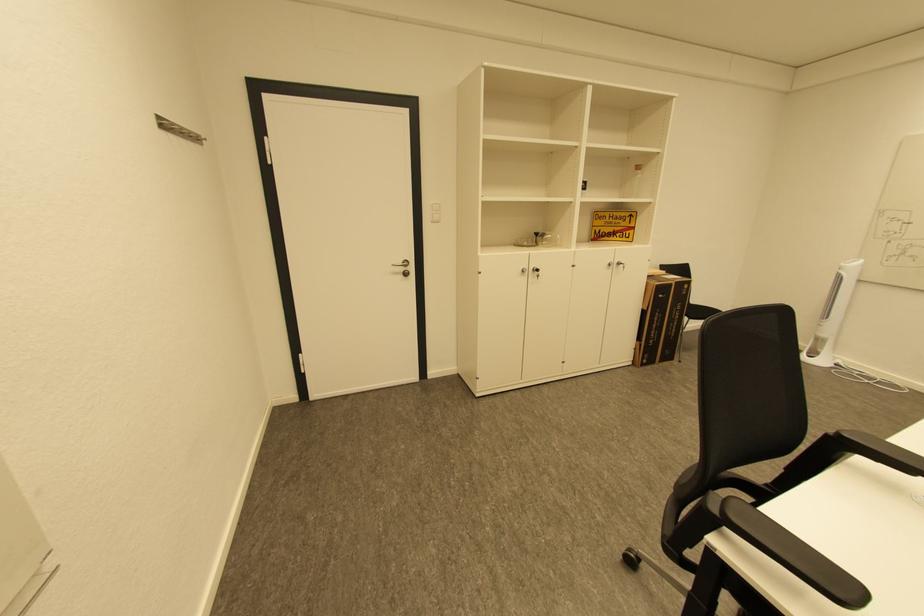
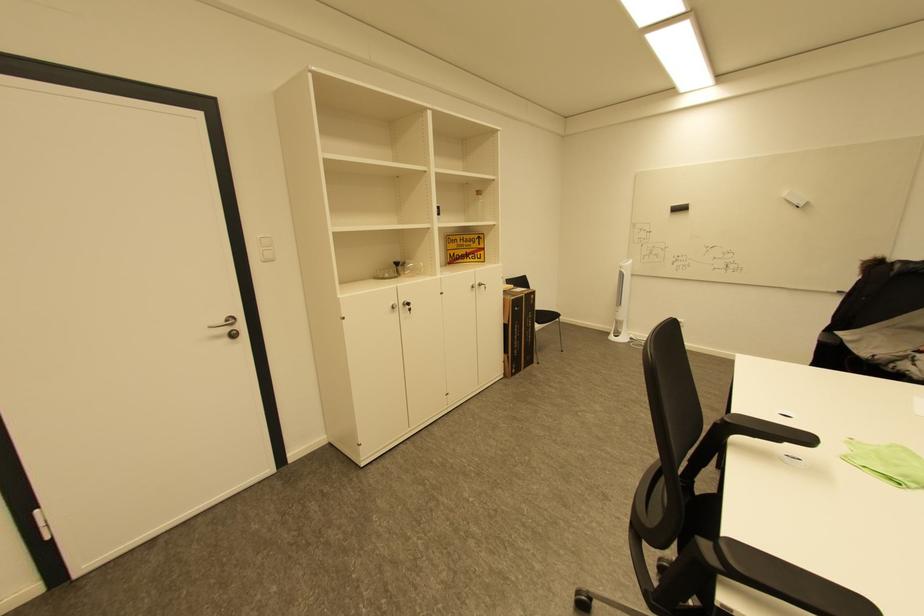
Question: The camera is either moving clockwise (left) or counter-clockwise (right) around the object. The first image is from the beginning of the video and the second image is from the end. Is the camera moving left or right when shooting the video?

Choices:
 (A) Left
 (B) Right

Answer: (A)